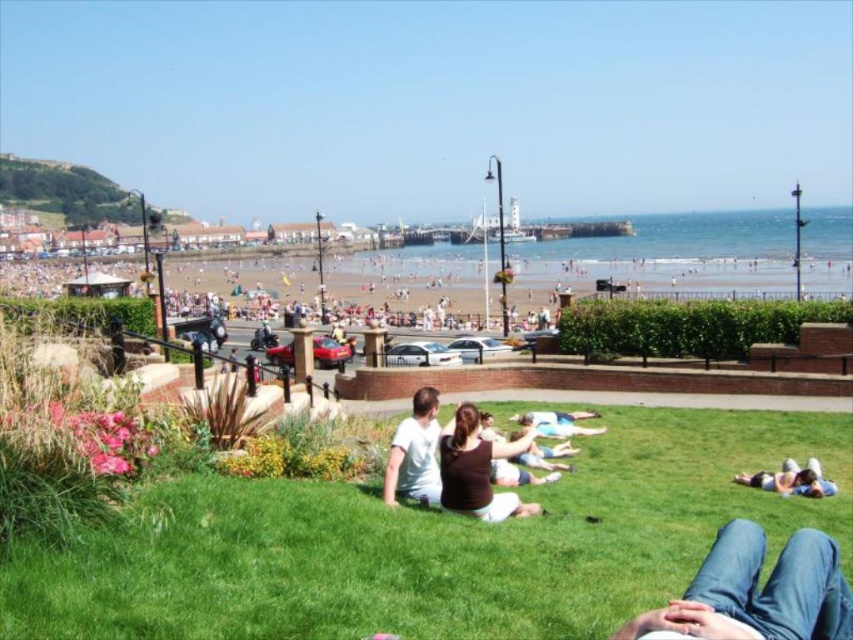
Question: Which object appears farthest from the camera in this image?

Choices:
 (A) blue denim jeans at lower right
 (B) brown fabric shirt at center
 (C) jeans at lower right

Answer: (A)

Question: Is blue denim jeans at lower right to the left of light blue fabric at center from the viewer's perspective?

Choices:
 (A) yes
 (B) no

Answer: (B)

Question: Where is brown fabric shirt at center located in relation to white cotton shirt at center in the image?

Choices:
 (A) above
 (B) below

Answer: (B)

Question: Which of these objects is positioned closest to the brown fabric shirt at center?

Choices:
 (A) jeans at lower right
 (B) blue denim jeans at lower right

Answer: (B)

Question: Considering the relative positions of blue denim jeans at lower right and light blue fabric at center in the image provided, where is blue denim jeans at lower right located with respect to light blue fabric at center?

Choices:
 (A) below
 (B) above

Answer: (A)

Question: Among these objects, which one is nearest to the camera?

Choices:
 (A) brown fabric shirt at center
 (B) white cotton shirt at center
 (C) blue denim jeans at lower right

Answer: (B)